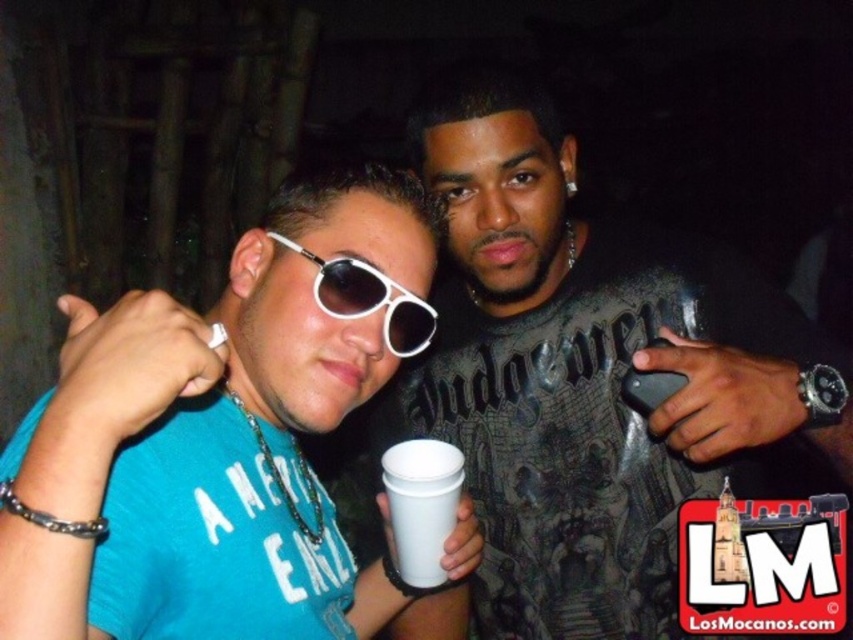
Can you confirm if matte white sunglasses at center is smaller than white plastic sunglasses at center?

Incorrect, matte white sunglasses at center is not smaller in size than white plastic sunglasses at center.

Is point (68, 401) farther from camera compared to point (349, 275)?

No, it is not.

The height and width of the screenshot is (640, 853). Identify the location of matte white sunglasses at center. (219, 435).

Between point (505, 438) and point (397, 300), which one is positioned behind?

Point (505, 438)

Consider the image. Between matte black shirt at center and white plastic sunglasses at center, which one has more height?

matte black shirt at center

The width and height of the screenshot is (853, 640). What are the coordinates of `matte black shirt at center` in the screenshot? It's located at (585, 376).

From the picture: Can you confirm if matte white sunglasses at center is thinner than white paper cup at center?

In fact, matte white sunglasses at center might be wider than white paper cup at center.

Can you confirm if matte white sunglasses at center is wider than white paper cup at center?

Yes.

The image size is (853, 640). Describe the element at coordinates (219, 435) in the screenshot. I see `matte white sunglasses at center` at that location.

Where is `matte white sunglasses at center`? matte white sunglasses at center is located at coordinates (219, 435).